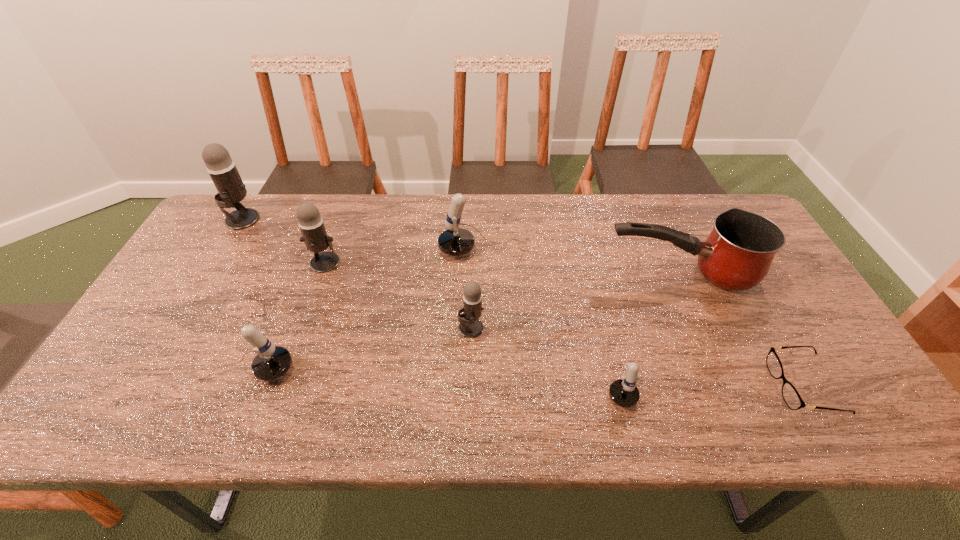
You are a GUI agent. You are given a task and a screenshot of the screen. Output one action in this format:
    pyautogui.click(x=<x>, y=<y>)
    Task: Click on the vacant area located on the back of the nearest gray microphone
    The height and width of the screenshot is (540, 960).
    Given the screenshot: What is the action you would take?
    pyautogui.click(x=472, y=221)

You are a GUI agent. You are given a task and a screenshot of the screen. Output one action in this format:
    pyautogui.click(x=<x>, y=<y>)
    Task: Click on the vacant space located on the back of the second shortest object
    This screenshot has height=540, width=960.
    Given the screenshot: What is the action you would take?
    pyautogui.click(x=605, y=328)

This screenshot has height=540, width=960. What are the coordinates of `free space located on the front-facing side of the spectacles` in the screenshot? It's located at (720, 387).

Where is `vacant region located on the front-facing side of the spectacles`? This screenshot has height=540, width=960. vacant region located on the front-facing side of the spectacles is located at coordinates (755, 387).

Where is `free region located 0.220m on the front-facing side of the spectacles`? The height and width of the screenshot is (540, 960). free region located 0.220m on the front-facing side of the spectacles is located at coordinates (682, 387).

Identify the location of microphone present at the near edge. (623, 392).

The width and height of the screenshot is (960, 540). Identify the location of spectacles located in the near edge section of the desktop. (793, 400).

Locate an element on the screen. The image size is (960, 540). object that is at the left edge is located at coordinates (222, 169).

Locate an element on the screen. saucepan at the right edge is located at coordinates (737, 254).

In order to click on spectacles that is at the right edge in this screenshot , I will do `click(793, 400)`.